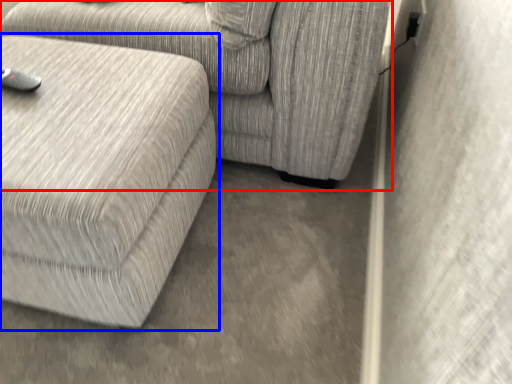
Question: Which of the following is the closest to the observer, studio couch (highlighted by a red box) or studio couch (highlighted by a blue box)?

Choices:
 (A) studio couch
 (B) studio couch

Answer: (B)